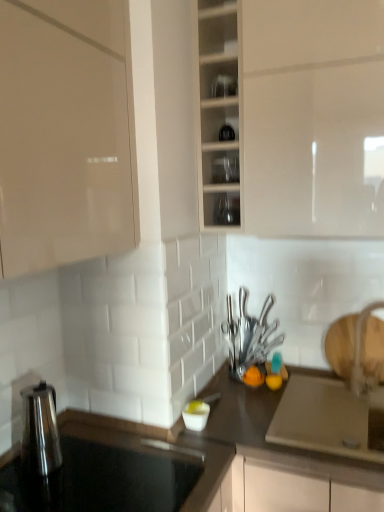
Measure the distance between transparent glass jars at upper center, the 2th shelf when ordered from bottom to top, and camera.

They are 1.45 meters apart.

What is the approximate width of clear glassware at center, acting as the first shelf starting from the bottom?

clear glassware at center, acting as the first shelf starting from the bottom, is 5.76 inches in width.

The height and width of the screenshot is (512, 384). What do you see at coordinates (274, 458) in the screenshot? I see `dark gray laminate countertop at center, which appears as the 2th countertop when viewed from the left` at bounding box center [274, 458].

Measure the distance between point (162, 446) and camera.

1.26 meters.

The image size is (384, 512). What do you see at coordinates (161, 451) in the screenshot? I see `black glossy countertop at lower left, acting as the second countertop starting from the right` at bounding box center [161, 451].

Locate an element on the screen. The image size is (384, 512). transparent glass jars at upper center, marked as the first shelf in a top-to-bottom arrangement is located at coordinates (218, 78).

Which object is closer to the camera, clear glassware at center, acting as the first shelf starting from the bottom, or transparent glass cabinet at center?

transparent glass cabinet at center is closer to the camera.

What's the angular difference between clear glassware at center, positioned as the second shelf in top-to-bottom order, and transparent glass cabinet at center's facing directions?

0.00103 degrees.

Between clear glassware at center, positioned as the second shelf in top-to-bottom order, and transparent glass cabinet at center, which one has smaller size?

clear glassware at center, positioned as the second shelf in top-to-bottom order.

Considering the sizes of objects clear glassware at center, positioned as the second shelf in top-to-bottom order, and transparent glass cabinet at center in the image provided, who is shorter, clear glassware at center, positioned as the second shelf in top-to-bottom order, or transparent glass cabinet at center?

With less height is clear glassware at center, positioned as the second shelf in top-to-bottom order.

In the scene shown: From the image's perspective, which object appears higher, black glossy countertop at lower left, acting as the first countertop starting from the top, or transparent glass jars at upper center, the 2th shelf when ordered from bottom to top?

From the image's view, transparent glass jars at upper center, the 2th shelf when ordered from bottom to top, is above.

The height and width of the screenshot is (512, 384). There is a transparent glass jars at upper center, the 2th shelf when ordered from bottom to top. In order to click on the 1st countertop below it (from the image's perspective) in this screenshot , I will do `click(161, 451)`.

Are black glossy countertop at lower left, acting as the second countertop starting from the right, and transparent glass jars at upper center, the 2th shelf when ordered from bottom to top, making contact?

No, black glossy countertop at lower left, acting as the second countertop starting from the right, is not with transparent glass jars at upper center, the 2th shelf when ordered from bottom to top.

Is point (365, 385) closer or farther from the camera than point (224, 206)?

Point (365, 385) is positioned closer to the camera compared to point (224, 206).

Starting from the white glossy faucet at right, which tableware is the 2nd one to the left? Please provide its 2D coordinates.

[(227, 211)]

From the image's perspective, is white glossy faucet at right under clear glass cups at center, which ranks as the 3th tableware in bottom-to-top order?

Yes, from the image's perspective, white glossy faucet at right is below clear glass cups at center, which ranks as the 3th tableware in bottom-to-top order.

In the scene shown: From a real-world perspective, which object stands above the other?

transparent glass cabinet at center.

Considering the relative sizes of transparent glass cabinet at center and white glossy bowl at center, the first tableware in the front-to-back sequence, in the image provided, is transparent glass cabinet at center bigger than white glossy bowl at center, the first tableware in the front-to-back sequence,?

Yes, transparent glass cabinet at center is bigger than white glossy bowl at center, the first tableware in the front-to-back sequence.

Between point (232, 142) and point (194, 421), which one is positioned behind?

The point (232, 142) is behind.

Can we say transparent glass cabinet at center lies outside white glossy bowl at center, marked as the third tableware in a back-to-front arrangement?

Yes, transparent glass cabinet at center is outside of white glossy bowl at center, marked as the third tableware in a back-to-front arrangement.

In the scene shown: Can you confirm if dark gray laminate countertop at center, which is counted as the first countertop, starting from the bottom, is wider than black glossy countertop at lower left, arranged as the second countertop when ordered from the bottom?

Correct, the width of dark gray laminate countertop at center, which is counted as the first countertop, starting from the bottom, exceeds that of black glossy countertop at lower left, arranged as the second countertop when ordered from the bottom.

Considering the positions of points (249, 423) and (205, 502), is point (249, 423) farther from camera compared to point (205, 502)?

Yes, point (249, 423) is farther from viewer.

From the image's perspective, is dark gray laminate countertop at center, which is the second countertop from top to bottom, above or below black glossy countertop at lower left, arranged as the second countertop when ordered from the bottom?

Based on their image positions, dark gray laminate countertop at center, which is the second countertop from top to bottom, is located beneath black glossy countertop at lower left, arranged as the second countertop when ordered from the bottom.

Who is more distant, dark gray laminate countertop at center, the first countertop positioned from the right, or black glossy countertop at lower left, placed as the 1th countertop when sorted from left to right?

dark gray laminate countertop at center, the first countertop positioned from the right, is behind.

In the scene shown: What's the angular difference between transparent glass jars at upper center, marked as the first shelf in a top-to-bottom arrangement, and polished silver knife set at center, the 2th tableware from the bottom,'s facing directions?

They differ by 0.0073 degrees in their facing directions.

Is transparent glass jars at upper center, the 2th shelf when ordered from bottom to top, not close to polished silver knife set at center, the third tableware when ordered from left to right?

No, there isn't a large distance between transparent glass jars at upper center, the 2th shelf when ordered from bottom to top, and polished silver knife set at center, the third tableware when ordered from left to right.

The height and width of the screenshot is (512, 384). In order to click on shelf that is the 2nd object located in front of the polished silver knife set at center, placed as the first tableware when sorted from right to left in this screenshot , I will do `click(218, 78)`.

Which of these two, transparent glass jars at upper center, the 2th shelf when ordered from bottom to top, or polished silver knife set at center, the third tableware positioned from the front, is smaller?

transparent glass jars at upper center, the 2th shelf when ordered from bottom to top, is smaller.

Which of these two, transparent glass cabinet at center or white glossy faucet at right, is wider?

Wider between the two is transparent glass cabinet at center.

The width and height of the screenshot is (384, 512). I want to click on faucet behind the transparent glass cabinet at center, so click(360, 355).

Would you say transparent glass cabinet at center contains white glossy faucet at right?

No, white glossy faucet at right is located outside of transparent glass cabinet at center.

Is transparent glass cabinet at center directly adjacent to white glossy faucet at right?

transparent glass cabinet at center and white glossy faucet at right are not in contact.

What are the coordinates of `shelf that is below the transparent glass cabinet at center (from the image's perspective)` in the screenshot? It's located at (221, 167).

At what (x,y) coordinates should I click in order to perform the action: click on the 1st shelf behind the black glossy countertop at lower left, acting as the second countertop starting from the right, counting from the anchor's position. Please return your answer as a coordinate pair (x, y). Image resolution: width=384 pixels, height=512 pixels. Looking at the image, I should click on (218, 78).

In the scene shown: Based on their spatial positions, is clear glass cups at center, marked as the 2th tableware in a right-to-left arrangement, or dark gray laminate countertop at center, which is counted as the first countertop, starting from the bottom, further from polished silver knife set at center, the third tableware when ordered from left to right?

Answer: Based on the image, clear glass cups at center, marked as the 2th tableware in a right-to-left arrangement, appears to be further to polished silver knife set at center, the third tableware when ordered from left to right.

Based on their spatial positions, is clear glassware at center, acting as the first shelf starting from the bottom, or black glossy countertop at lower left, placed as the 1th countertop when sorted from left to right, further from polished silver knife set at center, placed as the 2th tableware when sorted from top to bottom?

The object further to polished silver knife set at center, placed as the 2th tableware when sorted from top to bottom, is clear glassware at center, acting as the first shelf starting from the bottom.

From the image, which object appears to be farther from transparent glass cabinet at center, white glossy faucet at right or white glossy bowl at center, the first tableware in the bottom-to-top sequence?

The object further to transparent glass cabinet at center is white glossy bowl at center, the first tableware in the bottom-to-top sequence.

Based on their spatial positions, is white glossy bowl at center, the first tableware in the bottom-to-top sequence, or white glossy faucet at right closer to dark gray laminate countertop at center, the first countertop positioned from the right?

white glossy bowl at center, the first tableware in the bottom-to-top sequence, lies closer to dark gray laminate countertop at center, the first countertop positioned from the right, than the other object.

Based on the photo, which object lies further to the anchor point polished silver knife set at center, the third tableware when ordered from left to right, clear glass cups at center, marked as the second tableware in a front-to-back arrangement, or white glossy bowl at center, marked as the third tableware in a back-to-front arrangement?

clear glass cups at center, marked as the second tableware in a front-to-back arrangement.

When comparing their distances from white glossy faucet at right, does transparent glass cabinet at center or clear glassware at center, acting as the first shelf starting from the bottom, seem closer?

clear glassware at center, acting as the first shelf starting from the bottom.

Considering their positions, is polished silver knife set at center, the 2th tableware from the bottom, positioned further to white glossy bowl at center, the 3th tableware positioned from the top, than white glossy faucet at right?

Based on the image, white glossy faucet at right appears to be further to white glossy bowl at center, the 3th tableware positioned from the top.

From the image, which object appears to be farther from transparent glass cabinet at center, dark gray laminate countertop at center, which is counted as the first countertop, starting from the bottom, or clear glassware at center, acting as the first shelf starting from the bottom?

dark gray laminate countertop at center, which is counted as the first countertop, starting from the bottom, is further to transparent glass cabinet at center.

The image size is (384, 512). Identify the location of shelf between transparent glass cabinet at center and polished silver knife set at center, placed as the 2th tableware when sorted from top to bottom, in the vertical direction. (221, 167).

The height and width of the screenshot is (512, 384). I want to click on shelf that lies between transparent glass jars at upper center, marked as the first shelf in a top-to-bottom arrangement, and polished silver knife set at center, placed as the 2th tableware when sorted from top to bottom, from top to bottom, so click(221, 167).

This screenshot has width=384, height=512. Identify the location of cabinetry between transparent glass jars at upper center, marked as the first shelf in a top-to-bottom arrangement, and polished silver knife set at center, the third tableware positioned from the front, in the up-down direction. (220, 114).

Image resolution: width=384 pixels, height=512 pixels. Find the location of `cabinetry between transparent glass jars at upper center, marked as the first shelf in a top-to-bottom arrangement, and white glossy bowl at center, the first tableware in the bottom-to-top sequence, from top to bottom`. cabinetry between transparent glass jars at upper center, marked as the first shelf in a top-to-bottom arrangement, and white glossy bowl at center, the first tableware in the bottom-to-top sequence, from top to bottom is located at coordinates (220, 114).